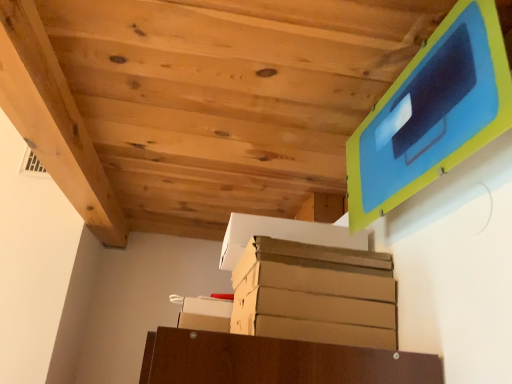
The height and width of the screenshot is (384, 512). What do you see at coordinates (205, 314) in the screenshot?
I see `white cardboard box at lower center, placed as the 2th cardboard box when sorted from top to bottom` at bounding box center [205, 314].

Measure the distance between point (195, 328) and camera.

Point (195, 328) and camera are 4.50 feet apart from each other.

What is the approximate height of white cardboard box at lower center, placed as the 2th cardboard box when sorted from top to bottom?

The height of white cardboard box at lower center, placed as the 2th cardboard box when sorted from top to bottom, is 5.46 centimeters.

You are a GUI agent. You are given a task and a screenshot of the screen. Output one action in this format:
    pyautogui.click(x=<x>, y=<y>)
    Task: Click on the white cardboard box at lower center, acting as the 1th cardboard box starting from the left
    The height and width of the screenshot is (384, 512).
    Given the screenshot: What is the action you would take?
    pyautogui.click(x=205, y=314)

The image size is (512, 384). Describe the element at coordinates (285, 235) in the screenshot. I see `brown cardboard box at center, which is the first cardboard box from top to bottom` at that location.

The image size is (512, 384). Find the location of `brown cardboard box at center, arranged as the second cardboard box when viewed from the left`. brown cardboard box at center, arranged as the second cardboard box when viewed from the left is located at coordinates (285, 235).

In order to click on white cardboard box at lower center, which appears as the 1th cardboard box when ordered from the bottom in this screenshot , I will do `click(205, 314)`.

Looking at this image, does white cardboard box at lower center, acting as the 1th cardboard box starting from the left, appear on the right side of brown cardboard box at center, which ranks as the second cardboard box in bottom-to-top order?

No.

Is white cardboard box at lower center, acting as the 1th cardboard box starting from the left, closer to camera compared to brown cardboard box at center, which is the first cardboard box from top to bottom?

No.

Considering the positions of point (199, 310) and point (252, 226), is point (199, 310) closer or farther from the camera than point (252, 226)?

Clearly, point (199, 310) is more distant from the camera than point (252, 226).

From the image's perspective, relative to brown cardboard box at center, which is counted as the first cardboard box, starting from the right, is white cardboard box at lower center, placed as the 2th cardboard box when sorted from top to bottom, above or below?

white cardboard box at lower center, placed as the 2th cardboard box when sorted from top to bottom, is situated lower than brown cardboard box at center, which is counted as the first cardboard box, starting from the right, in the image.

From a real-world perspective, is white cardboard box at lower center, placed as the 2th cardboard box when sorted from top to bottom, below brown cardboard box at center, which is the first cardboard box from top to bottom?

Indeed, from a real-world perspective, white cardboard box at lower center, placed as the 2th cardboard box when sorted from top to bottom, is positioned beneath brown cardboard box at center, which is the first cardboard box from top to bottom.

Looking at this image, between white cardboard box at lower center, acting as the 1th cardboard box starting from the left, and brown cardboard box at center, arranged as the second cardboard box when viewed from the left, which one has larger width?

brown cardboard box at center, arranged as the second cardboard box when viewed from the left, is wider.

Can you confirm if white cardboard box at lower center, placed as the 2th cardboard box when sorted from top to bottom, is taller than brown cardboard box at center, which is the first cardboard box from top to bottom?

No, white cardboard box at lower center, placed as the 2th cardboard box when sorted from top to bottom, is not taller than brown cardboard box at center, which is the first cardboard box from top to bottom.

Between white cardboard box at lower center, placed as the 2th cardboard box when sorted from top to bottom, and brown cardboard box at center, which is counted as the first cardboard box, starting from the right, which one has larger size?

Bigger between the two is brown cardboard box at center, which is counted as the first cardboard box, starting from the right.

Is white cardboard box at lower center, acting as the 1th cardboard box starting from the left, inside the boundaries of brown cardboard box at center, arranged as the second cardboard box when viewed from the left, or outside?

white cardboard box at lower center, acting as the 1th cardboard box starting from the left, cannot be found inside brown cardboard box at center, arranged as the second cardboard box when viewed from the left.

Is white cardboard box at lower center, which appears as the 1th cardboard box when ordered from the bottom, far away from brown cardboard box at center, which is the first cardboard box from top to bottom?

white cardboard box at lower center, which appears as the 1th cardboard box when ordered from the bottom, is near brown cardboard box at center, which is the first cardboard box from top to bottom, not far away.

Is white cardboard box at lower center, placed as the 2th cardboard box when sorted from top to bottom, looking in the opposite direction of brown cardboard box at center, which is the first cardboard box from top to bottom?

No, white cardboard box at lower center, placed as the 2th cardboard box when sorted from top to bottom, is not facing away from brown cardboard box at center, which is the first cardboard box from top to bottom.

In the scene shown: Can you tell me how much white cardboard box at lower center, acting as the 1th cardboard box starting from the left, and brown cardboard box at center, arranged as the second cardboard box when viewed from the left, differ in facing direction?

There is a 0.000675-degree angle between the facing directions of white cardboard box at lower center, acting as the 1th cardboard box starting from the left, and brown cardboard box at center, arranged as the second cardboard box when viewed from the left.

Identify the location of cardboard box that appears on the left of brown cardboard box at center, which is counted as the first cardboard box, starting from the right. Image resolution: width=512 pixels, height=384 pixels. (205, 314).

Considering the positions of objects brown cardboard box at center, arranged as the second cardboard box when viewed from the left, and white cardboard box at lower center, which appears as the 1th cardboard box when ordered from the bottom, in the image provided, who is more to the right, brown cardboard box at center, arranged as the second cardboard box when viewed from the left, or white cardboard box at lower center, which appears as the 1th cardboard box when ordered from the bottom,?

brown cardboard box at center, arranged as the second cardboard box when viewed from the left, is more to the right.

Who is more distant, brown cardboard box at center, arranged as the second cardboard box when viewed from the left, or white cardboard box at lower center, placed as the 2th cardboard box when sorted from top to bottom?

white cardboard box at lower center, placed as the 2th cardboard box when sorted from top to bottom, is further from the camera.

Does point (266, 221) come closer to viewer compared to point (190, 310)?

Yes.

From the image's perspective, relative to white cardboard box at lower center, acting as the 1th cardboard box starting from the left, is brown cardboard box at center, which is counted as the first cardboard box, starting from the right, above or below?

Clearly, from the image's perspective, brown cardboard box at center, which is counted as the first cardboard box, starting from the right, is above white cardboard box at lower center, acting as the 1th cardboard box starting from the left.

From the picture: From a real-world perspective, does brown cardboard box at center, which is counted as the first cardboard box, starting from the right, stand above white cardboard box at lower center, acting as the 1th cardboard box starting from the left?

Yes, from a real-world perspective, brown cardboard box at center, which is counted as the first cardboard box, starting from the right, is above white cardboard box at lower center, acting as the 1th cardboard box starting from the left.

Looking at this image, which object is thinner, brown cardboard box at center, which is counted as the first cardboard box, starting from the right, or white cardboard box at lower center, placed as the 2th cardboard box when sorted from top to bottom?

Thinner between the two is white cardboard box at lower center, placed as the 2th cardboard box when sorted from top to bottom.

Who is taller, brown cardboard box at center, which ranks as the second cardboard box in bottom-to-top order, or white cardboard box at lower center, the second cardboard box in the right-to-left sequence?

Standing taller between the two is brown cardboard box at center, which ranks as the second cardboard box in bottom-to-top order.

Who is smaller, brown cardboard box at center, which is the first cardboard box from top to bottom, or white cardboard box at lower center, acting as the 1th cardboard box starting from the left?

white cardboard box at lower center, acting as the 1th cardboard box starting from the left.

Is white cardboard box at lower center, which appears as the 1th cardboard box when ordered from the bottom, surrounded by brown cardboard box at center, arranged as the second cardboard box when viewed from the left?

Definitely not — white cardboard box at lower center, which appears as the 1th cardboard box when ordered from the bottom, is not inside brown cardboard box at center, arranged as the second cardboard box when viewed from the left.

Would you consider brown cardboard box at center, which is the first cardboard box from top to bottom, to be distant from white cardboard box at lower center, the second cardboard box in the right-to-left sequence?

No, brown cardboard box at center, which is the first cardboard box from top to bottom, is not far from white cardboard box at lower center, the second cardboard box in the right-to-left sequence.

Is brown cardboard box at center, which ranks as the second cardboard box in bottom-to-top order, facing towards white cardboard box at lower center, placed as the 2th cardboard box when sorted from top to bottom?

No, brown cardboard box at center, which ranks as the second cardboard box in bottom-to-top order, is not turned towards white cardboard box at lower center, placed as the 2th cardboard box when sorted from top to bottom.

I want to click on cardboard box below the brown cardboard box at center, arranged as the second cardboard box when viewed from the left (from a real-world perspective), so click(205, 314).

Where is `cardboard box below the brown cardboard box at center, which is counted as the first cardboard box, starting from the right (from the image's perspective)`? Image resolution: width=512 pixels, height=384 pixels. cardboard box below the brown cardboard box at center, which is counted as the first cardboard box, starting from the right (from the image's perspective) is located at coordinates (205, 314).

Locate an element on the screen. cardboard box in front of the white cardboard box at lower center, placed as the 2th cardboard box when sorted from top to bottom is located at coordinates (x=285, y=235).